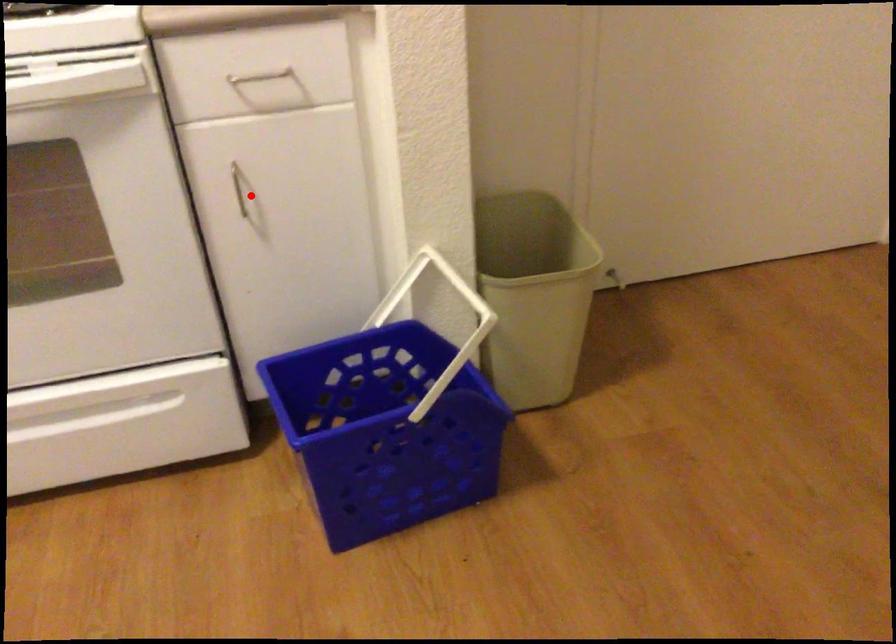
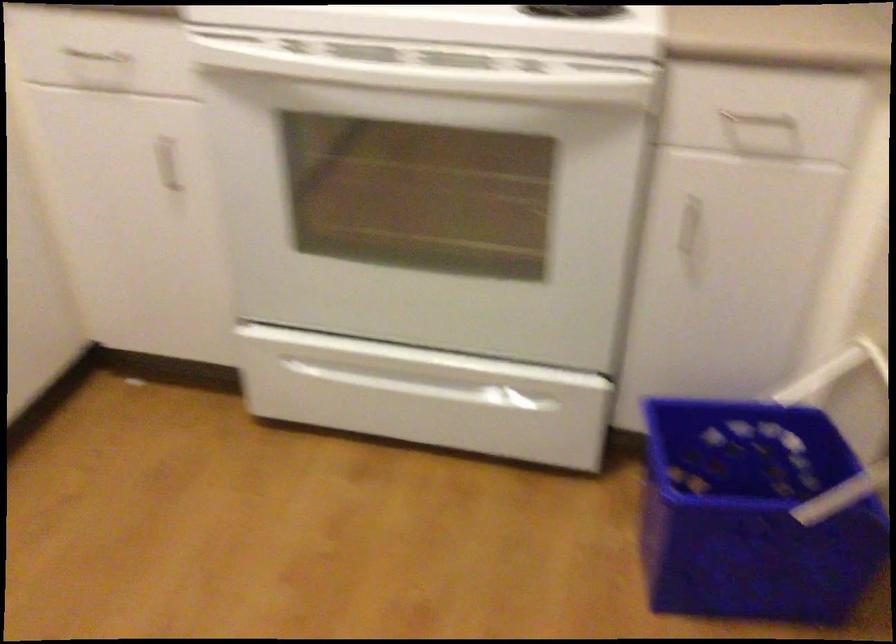
The point at the highlighted location is marked in the first image. Where is the corresponding point in the second image?

(691, 228)